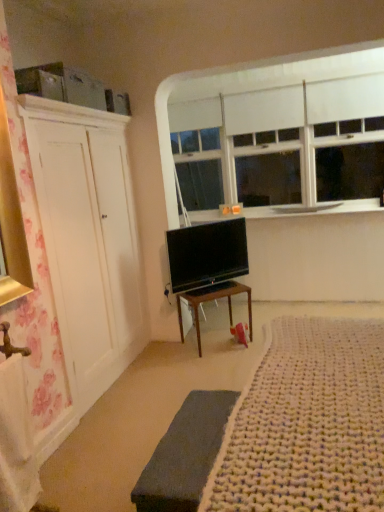
What are the coordinates of `vacant space situated above dark gray fabric bed frame at lower center (from a real-world perspective)` in the screenshot? It's located at (174, 457).